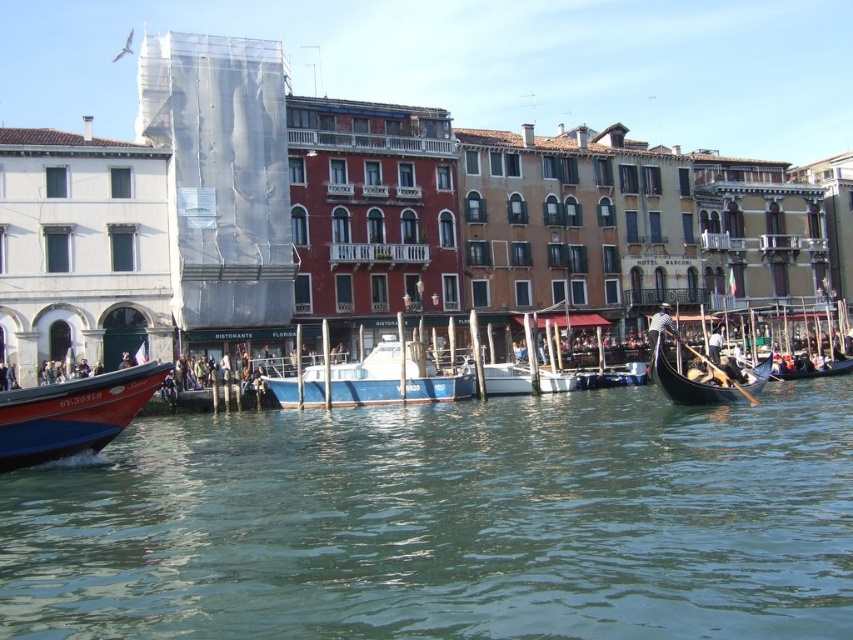
Question: Can you confirm if red glossy boat at lower left is bigger than blue matte boat at center?

Choices:
 (A) yes
 (B) no

Answer: (B)

Question: Which of the following is the farthest from the observer?

Choices:
 (A) greenish water at center
 (B) black polished wood gondola at center
 (C) blue matte boat at center

Answer: (C)

Question: Considering the relative positions of greenish water at center and blue matte boat at center in the image provided, where is greenish water at center located with respect to blue matte boat at center?

Choices:
 (A) above
 (B) below

Answer: (B)

Question: Observing the image, what is the correct spatial positioning of greenish water at center in reference to blue matte boat at center?

Choices:
 (A) left
 (B) right

Answer: (B)

Question: Which point is closer to the camera?

Choices:
 (A) black polished wood gondola at center
 (B) blue matte boat at center
 (C) red glossy boat at lower left

Answer: (C)

Question: Which point is closer to the camera?

Choices:
 (A) (387, 342)
 (B) (793, 483)
 (C) (706, 376)

Answer: (B)